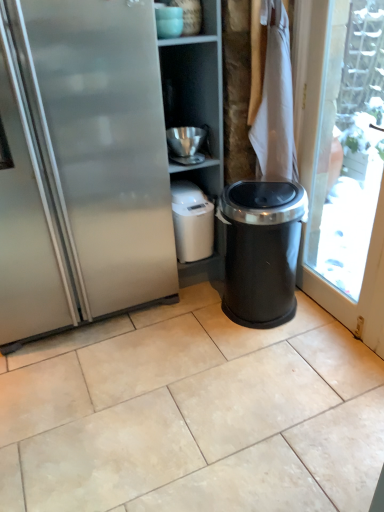
Question: From the image's perspective, is black plastic trash can at right located above or below matte ceramic bowl at upper center, marked as the 1th appliance in a front-to-back arrangement?

Choices:
 (A) above
 (B) below

Answer: (B)

Question: Visually, is black plastic trash can at right positioned to the left or to the right of matte ceramic bowl at upper center, marked as the 1th appliance in a front-to-back arrangement?

Choices:
 (A) right
 (B) left

Answer: (A)

Question: Which of these objects is positioned closest to the white matte appliance at center, which appears as the 3th appliance when viewed from the top?

Choices:
 (A) black plastic trash can at right
 (B) white fabric at upper right
 (C) beige ceramic tile at center
 (D) stainless steel fridge at left
 (E) metallic silver bowl at upper center, which appears as the second appliance when viewed from the back

Answer: (E)

Question: Which of these objects is positioned closest to the metallic silver bowl at upper center, positioned as the second appliance in front-to-back order?

Choices:
 (A) matte ceramic bowl at upper center, marked as the 1th appliance in a front-to-back arrangement
 (B) black plastic trash can at right
 (C) white matte appliance at center, which appears as the 3th appliance when viewed from the top
 (D) white fabric at upper right
 (E) stainless steel fridge at left

Answer: (C)